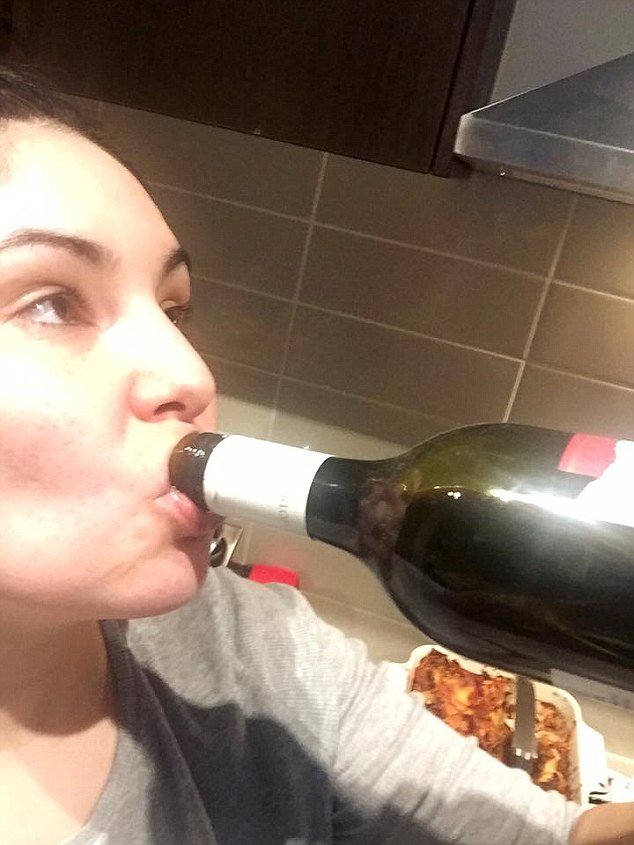
In order to click on oven light in this screenshot , I will do `click(577, 154)`.